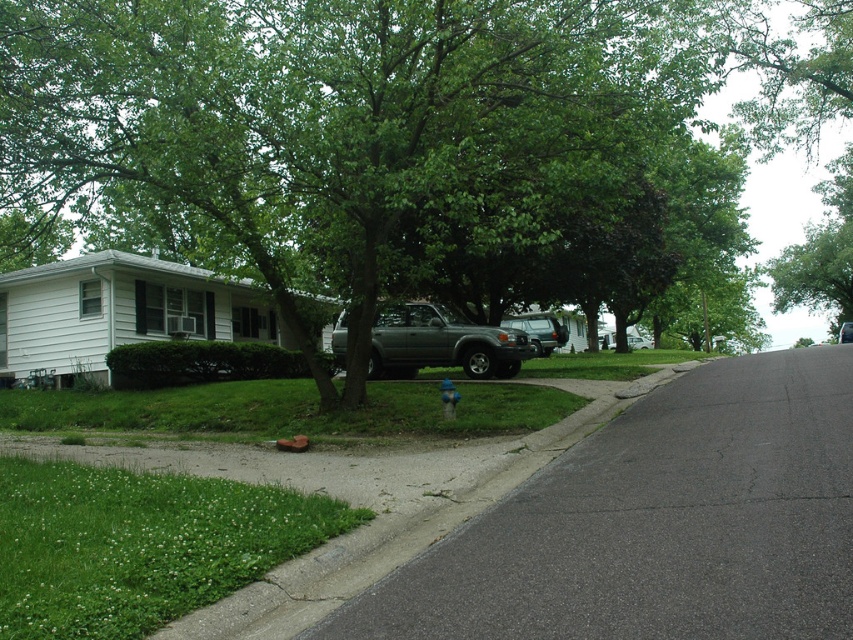
Who is more forward, (x=466, y=353) or (x=534, y=324)?

Point (x=466, y=353) is more forward.

In the scene shown: Between satin gray suv at center and metallic gray suv at center, which one has more height?

metallic gray suv at center

Which is behind, point (473, 333) or point (532, 332)?

The point (532, 332) is behind.

Locate an element on the screen. satin gray suv at center is located at coordinates (440, 342).

Between point (193, 628) and point (531, 336), which one is positioned in front?

Point (193, 628) is in front.

Looking at this image, which is above, gray concrete curb at lower left or metallic gray suv at center?

metallic gray suv at center

Who is more distant from viewer, (331, 561) or (537, 328)?

Point (537, 328)

In order to click on gray concrete curb at lower left in this screenshot , I will do `click(403, 525)`.

Which is in front, point (492, 148) or point (521, 314)?

Positioned in front is point (492, 148).

Is point (509, 120) positioned after point (531, 330)?

No, it is in front of (531, 330).

Find the location of `green leafy tree at center`. green leafy tree at center is located at coordinates (373, 145).